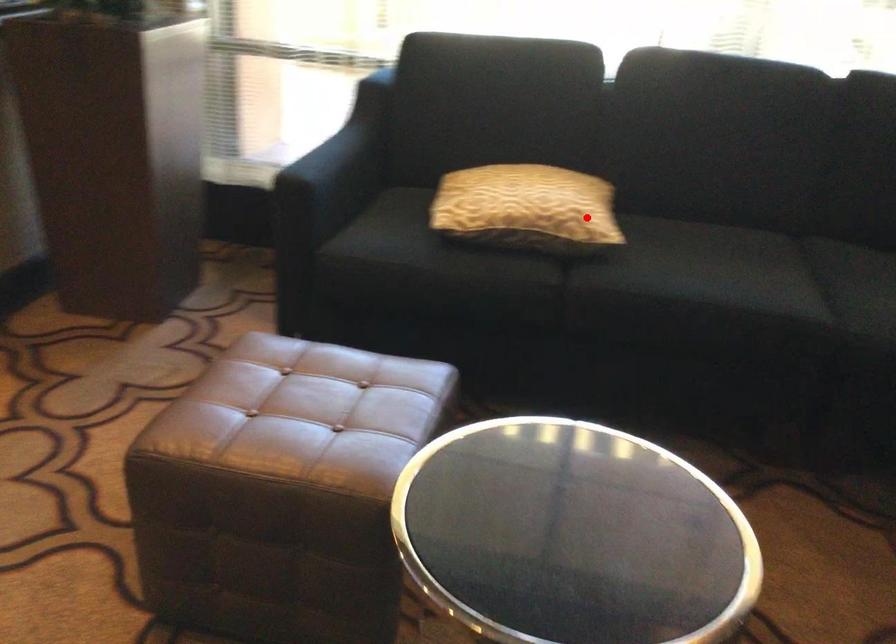
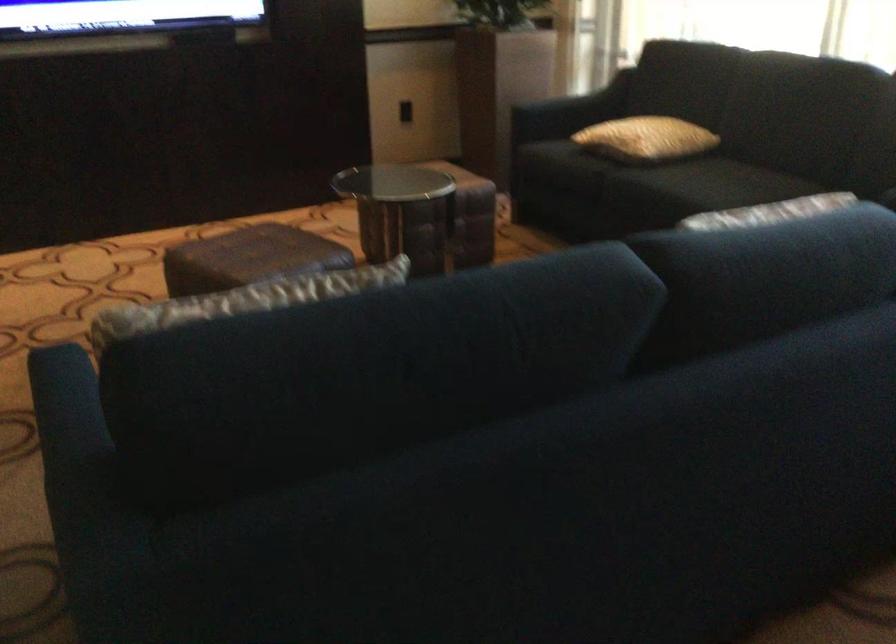
Locate, in the second image, the point that corresponds to the highlighted location in the first image.

(645, 138)